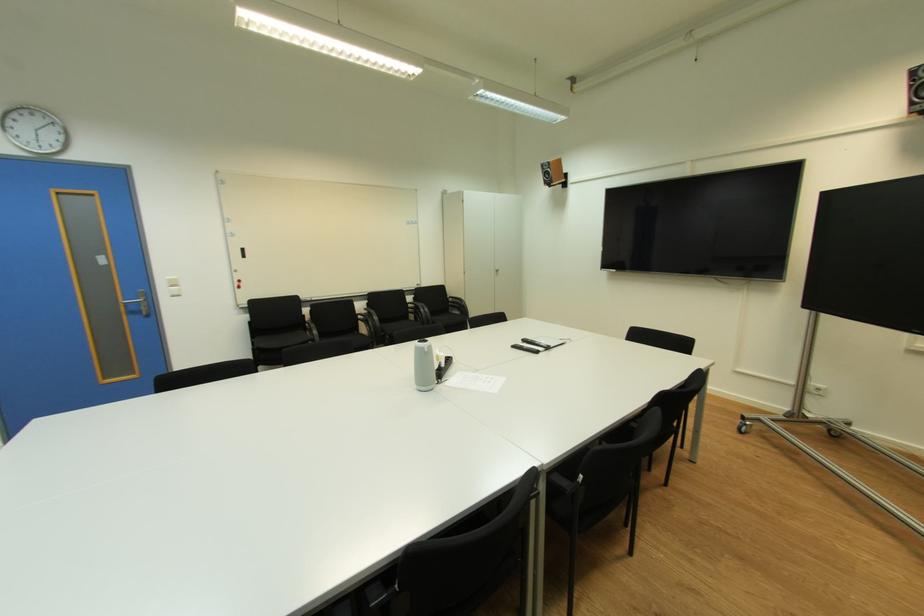
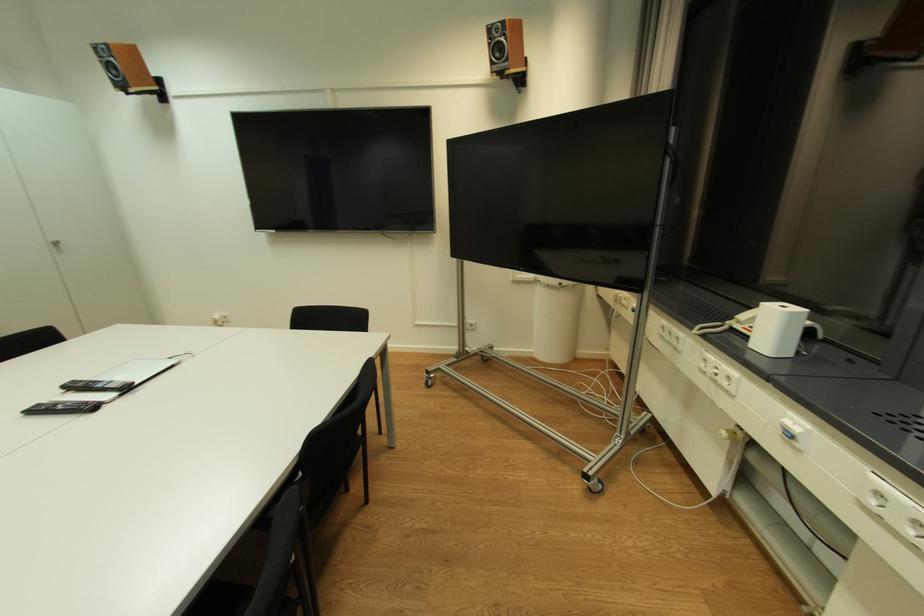
Question: The camera is either moving clockwise (left) or counter-clockwise (right) around the object. The first image is from the beginning of the video and the second image is from the end. Is the camera moving left or right when shooting the video?

Choices:
 (A) Left
 (B) Right

Answer: (A)